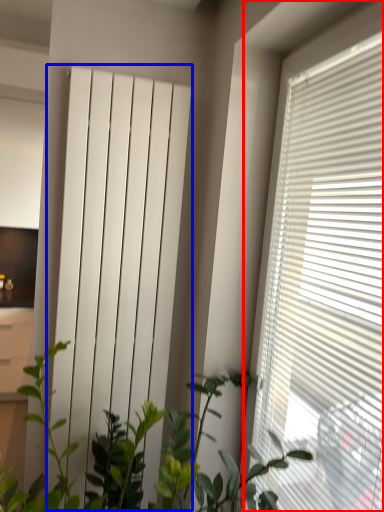
Question: Among these objects, which one is nearest to the camera, window blind (highlighted by a red box) or curtain (highlighted by a blue box)?

Choices:
 (A) window blind
 (B) curtain

Answer: (A)